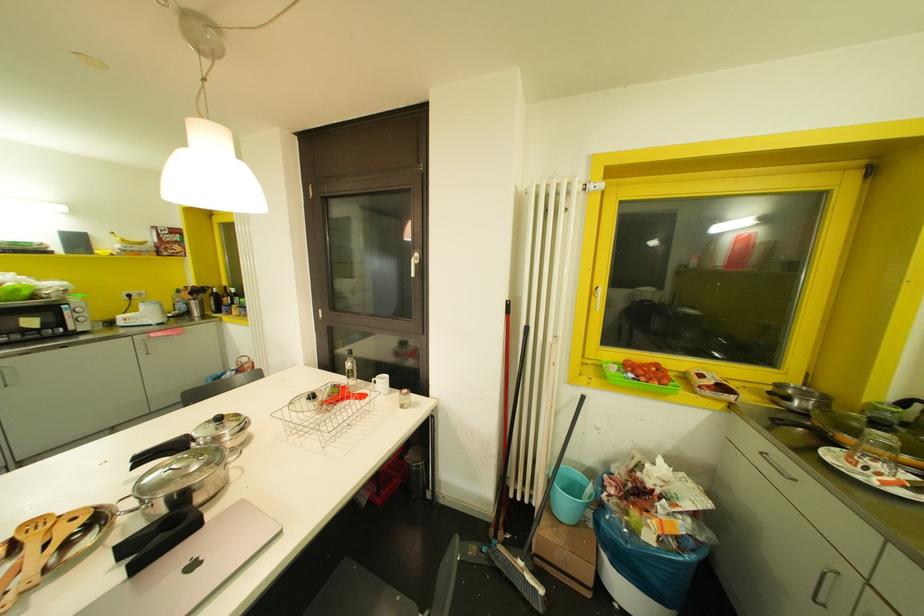
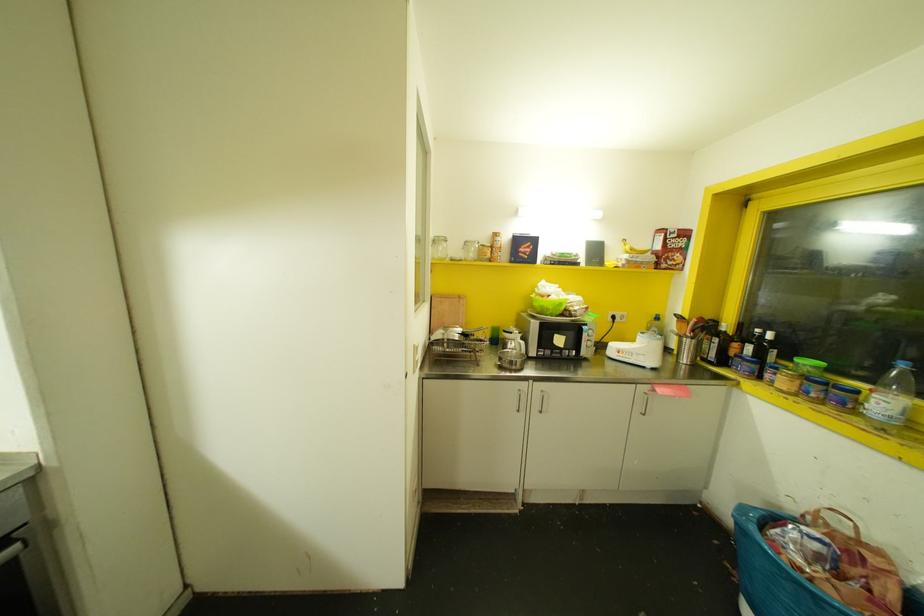
Locate, in the second image, the point that corresponds to point (219, 309) in the first image.

(723, 361)